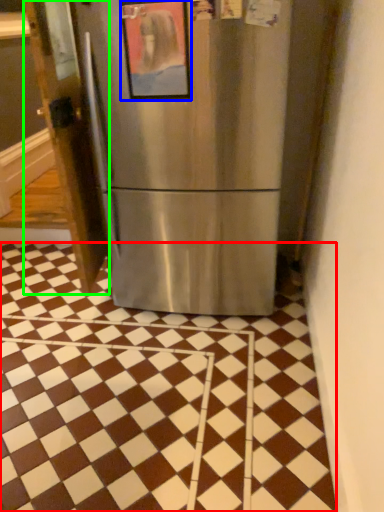
Question: Which object is positioned farthest from tile (highlighted by a red box)? Select from picture frame (highlighted by a blue box) and door (highlighted by a green box).

Choices:
 (A) picture frame
 (B) door

Answer: (A)